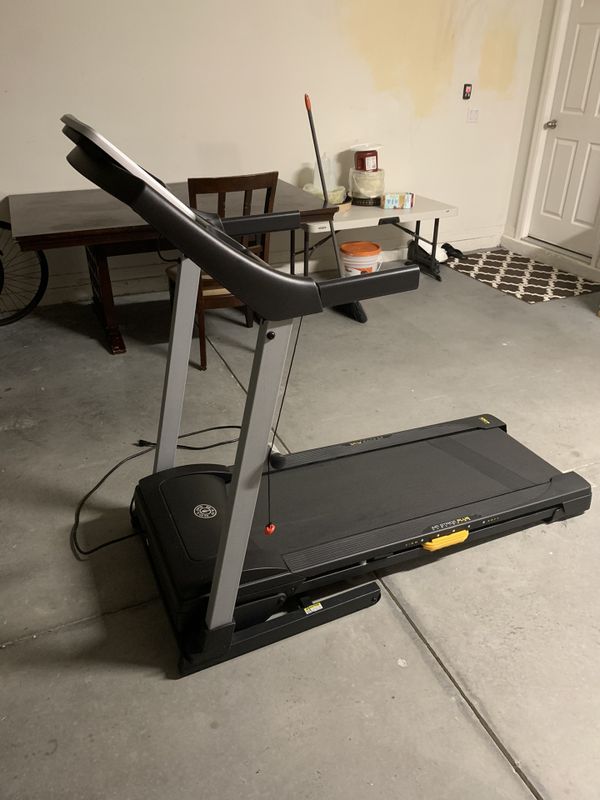
In order to click on wall in this screenshot , I will do `click(428, 270)`.